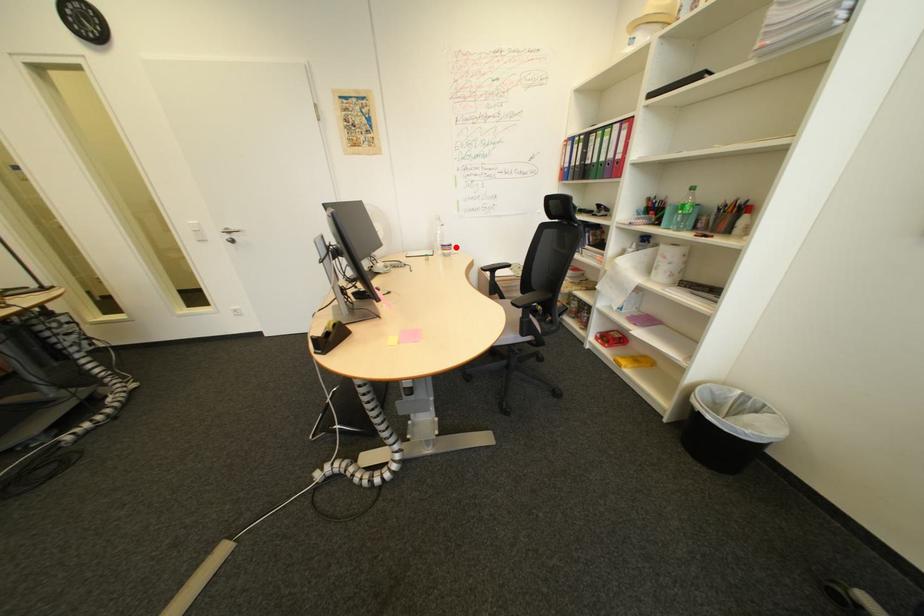
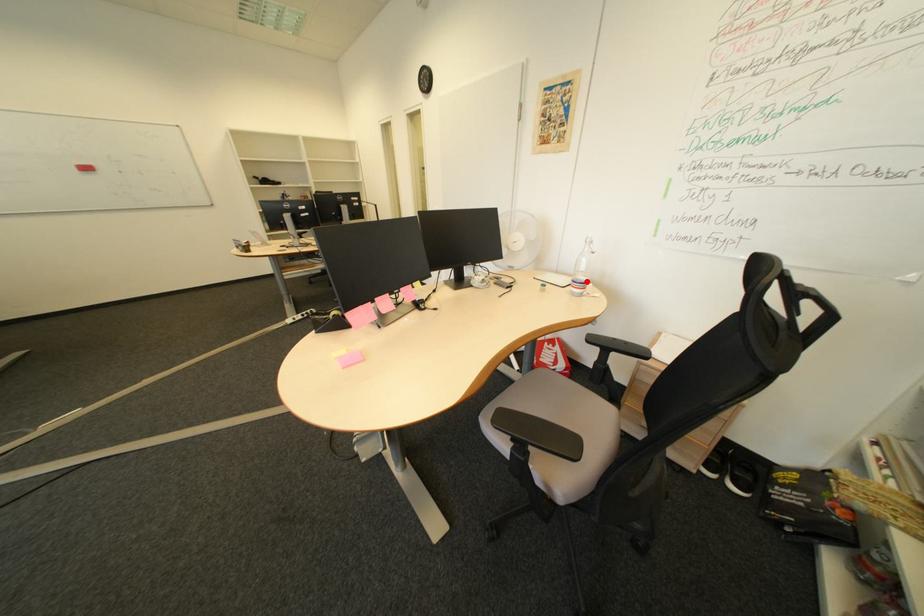
I am providing you with two images of the same scene from different viewpoints. A red point is marked on the first image and another point is marked on the second image. Does the point marked in image1 correspond to the same location as the one in image2?

Yes